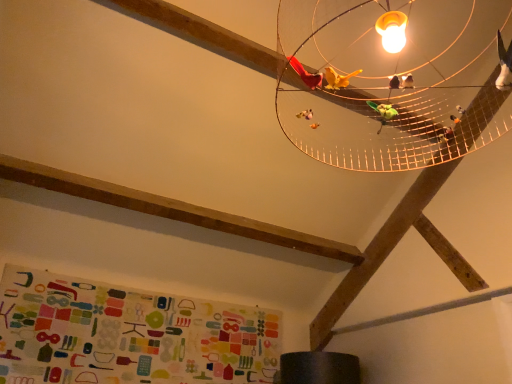
Question: In terms of height, does metallic wire mesh at upper center look taller or shorter compared to multicolored fabric bulletin board at lower left?

Choices:
 (A) tall
 (B) short

Answer: (A)

Question: Looking at their shapes, would you say metallic wire mesh at upper center is wider or thinner than multicolored fabric bulletin board at lower left?

Choices:
 (A) thin
 (B) wide

Answer: (B)

Question: Is metallic wire mesh at upper center to the left or to the right of multicolored fabric bulletin board at lower left in the image?

Choices:
 (A) right
 (B) left

Answer: (A)

Question: Is point (159, 344) positioned closer to the camera than point (372, 64)?

Choices:
 (A) closer
 (B) farther

Answer: (B)

Question: Which is correct: multicolored fabric bulletin board at lower left is inside metallic wire mesh at upper center, or outside of it?

Choices:
 (A) inside
 (B) outside

Answer: (B)

Question: Is multicolored fabric bulletin board at lower left to the left or to the right of metallic wire mesh at upper center in the image?

Choices:
 (A) left
 (B) right

Answer: (A)

Question: From a real-world perspective, is multicolored fabric bulletin board at lower left positioned above or below metallic wire mesh at upper center?

Choices:
 (A) below
 (B) above

Answer: (A)